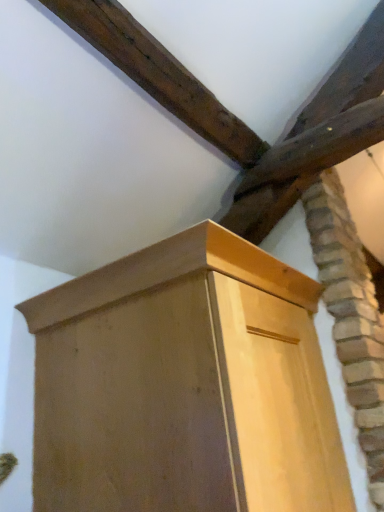
Question: Should I look upward or downward to see natural wood cupboard at center?

Choices:
 (A) up
 (B) down

Answer: (B)